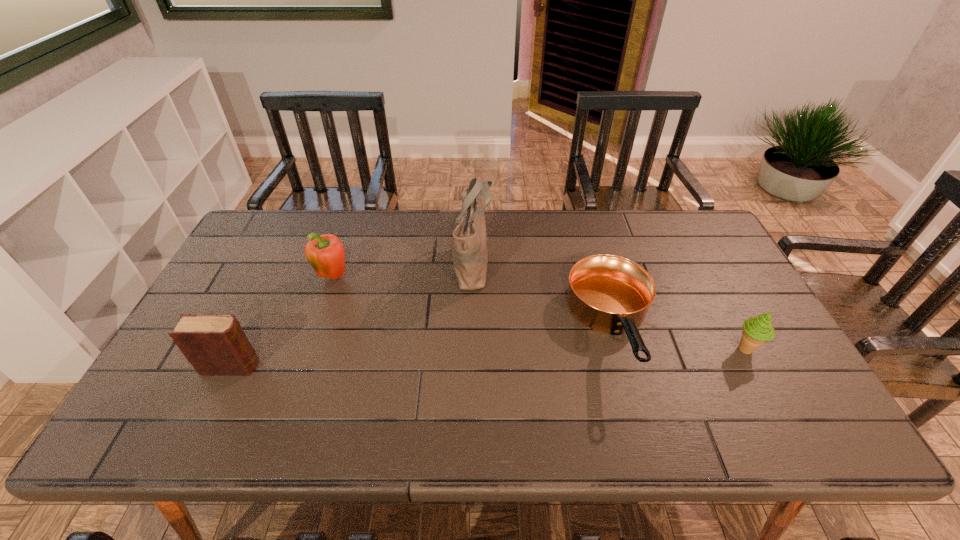
Where is `object present at the far edge`? object present at the far edge is located at coordinates (470, 254).

Identify the location of object located in the left edge section of the desktop. The width and height of the screenshot is (960, 540). (214, 344).

Locate an element on the screen. object that is at the right edge is located at coordinates (757, 330).

You are a GUI agent. You are given a task and a screenshot of the screen. Output one action in this format:
    pyautogui.click(x=<x>, y=<y>)
    Task: Click on the free region at the far edge
    
    Given the screenshot: What is the action you would take?
    pyautogui.click(x=543, y=214)

This screenshot has height=540, width=960. In the image, there is a desktop. Identify the location of vacant space at the far left corner. (259, 247).

This screenshot has width=960, height=540. I want to click on vacant space at the near left corner, so click(x=192, y=413).

In order to click on vacant area at the near right corner of the desktop in this screenshot , I will do `click(774, 419)`.

This screenshot has height=540, width=960. Identify the location of free space between the rightmost object and the pepper. (540, 313).

You are a GUI agent. You are given a task and a screenshot of the screen. Output one action in this format:
    pyautogui.click(x=<x>, y=<y>)
    Task: Click on the vacant area between the rightmost object and the leftmost object
    The height and width of the screenshot is (540, 960).
    Given the screenshot: What is the action you would take?
    pyautogui.click(x=489, y=358)

I want to click on vacant point located between the leftmost object and the fourth object from left to right, so click(422, 347).